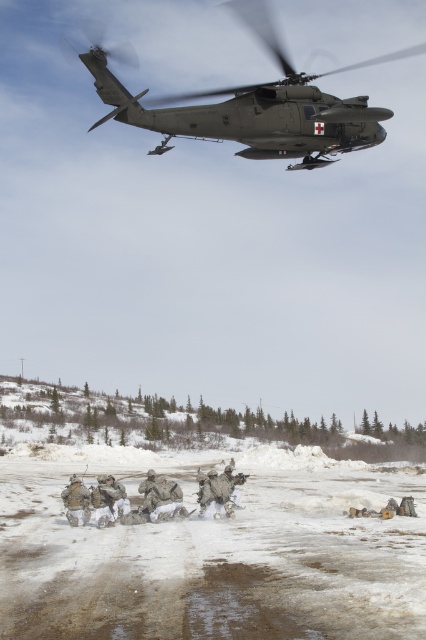
You are a soldier in the snow and need to take cover from incoming fire. The matte green helicopter at upper center and the camouflage fabric uniform at center are in your line of sight. Which object can provide better cover based on their sizes?

The matte green helicopter at upper center has a greater height compared to the camouflage fabric uniform at center, so it can provide better cover.

Looking at this image, you are a soldier on the ground and you see the matte green helicopter at upper center and the camouflage fabric uniform at center. Which object is higher in the scene?

The matte green helicopter at upper center is positioned over camouflage fabric uniform at center, so the matte green helicopter at upper center is higher.

In the scene shown: You are a soldier on the ground observing the matte green helicopter at upper center and the camouflage fabric uniform at center. Which object is nearer to you?

The matte green helicopter at upper center is closer to the viewer than the camouflage fabric uniform at center.